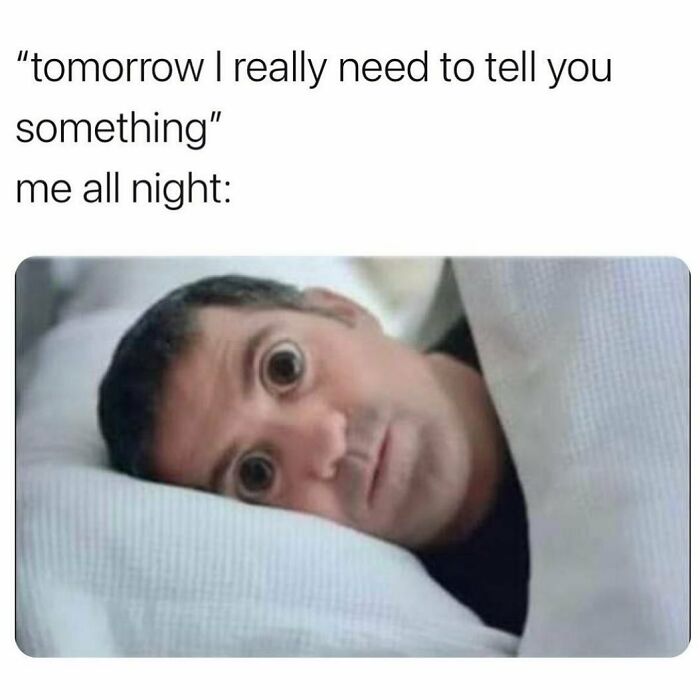
You are a GUI agent. You are given a task and a screenshot of the screen. Output one action in this format:
    pyautogui.click(x=<x>, y=<y>)
    Task: Click on the blanket
    
    Given the screenshot: What is the action you would take?
    pyautogui.click(x=575, y=533)